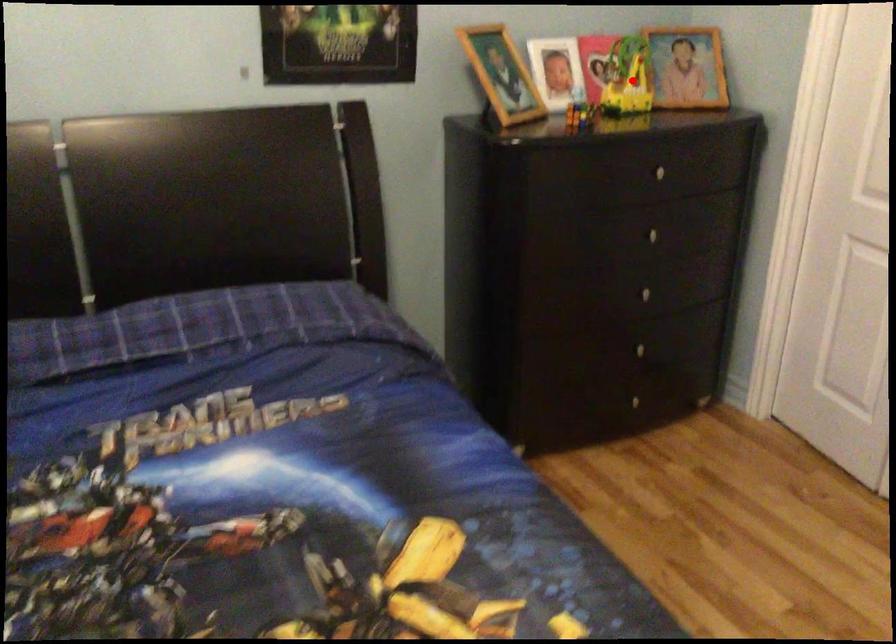
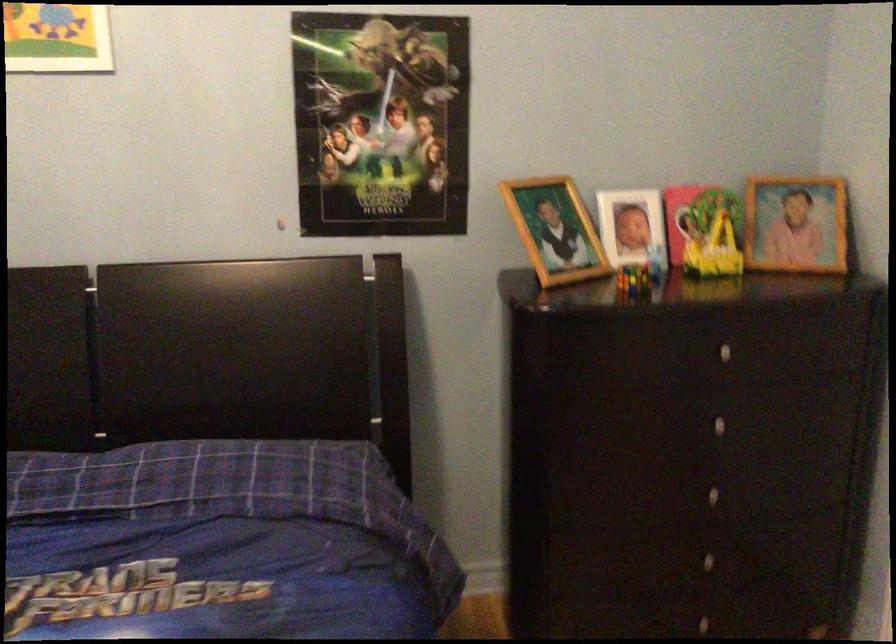
In the second image, find the point that corresponds to the highlighted location in the first image.

(719, 240)